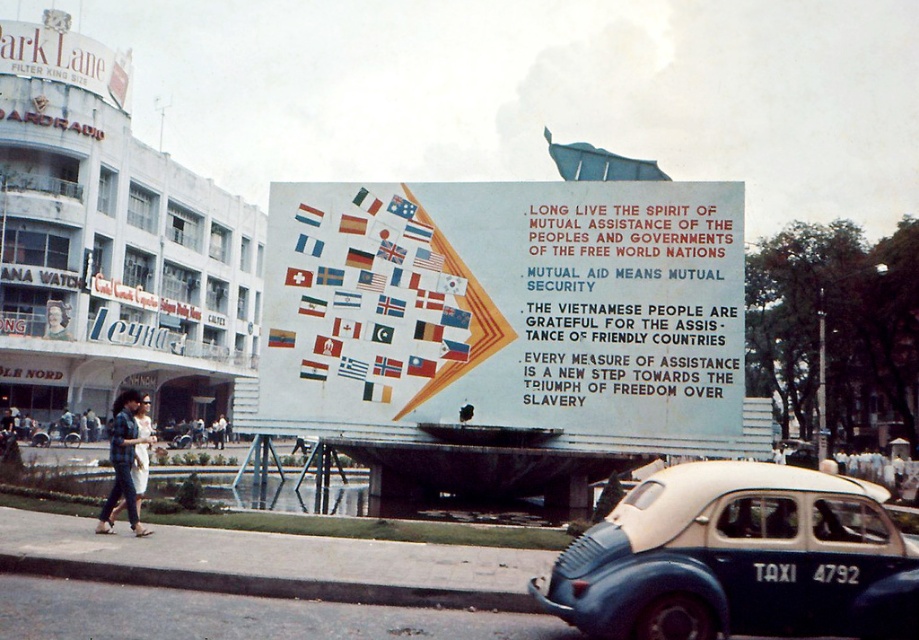
Can you confirm if blue matte taxi cab at lower right is wider than plaid shirt at lower left?

No.

Who is more distant from viewer, (851, 518) or (112, 440)?

Point (112, 440)

Image resolution: width=919 pixels, height=640 pixels. What are the coordinates of `blue matte taxi cab at lower right` in the screenshot? It's located at (738, 560).

Is the position of white painted billboard at center more distant than that of blue matte taxi cab at lower right?

Yes.

Does point (611, 429) come behind point (895, 538)?

Yes, it is behind point (895, 538).

Image resolution: width=919 pixels, height=640 pixels. What do you see at coordinates (506, 307) in the screenshot?
I see `white painted billboard at center` at bounding box center [506, 307].

Locate an element on the screen. white painted billboard at center is located at coordinates (506, 307).

Is the position of white painted billboard at center less distant than that of plaid shirt at lower left?

No.

Between white painted billboard at center and plaid shirt at lower left, which one has less height?

plaid shirt at lower left is shorter.

The image size is (919, 640). Identify the location of white painted billboard at center. (506, 307).

At what (x,y) coordinates should I click in order to perform the action: click on white painted billboard at center. Please return your answer as a coordinate pair (x, y). The width and height of the screenshot is (919, 640). Looking at the image, I should click on (506, 307).